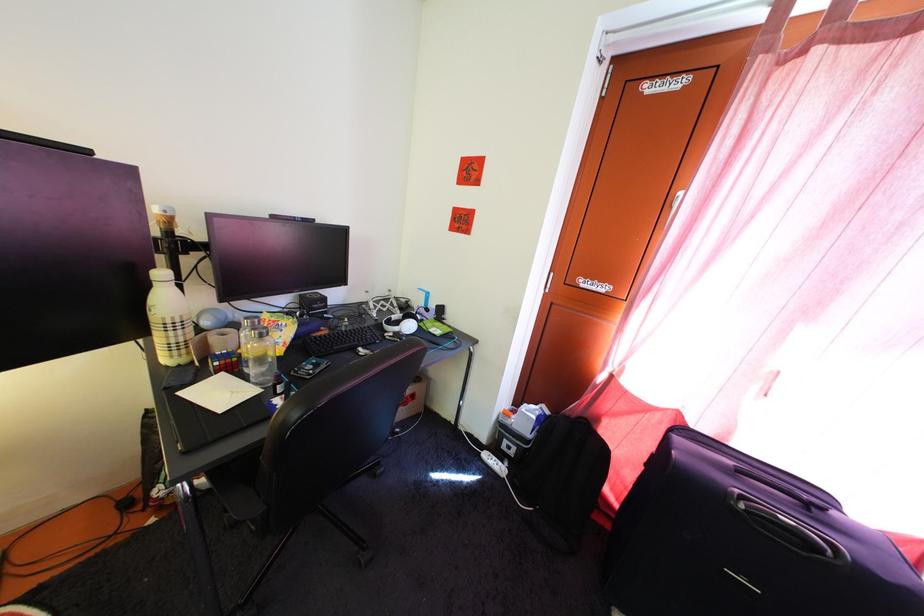
Locate an element on the screen. clear water bottle is located at coordinates (261, 357).